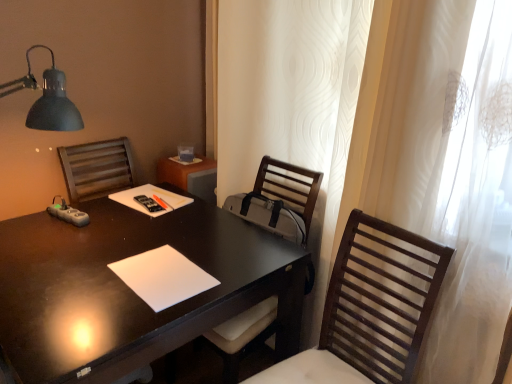
In order to click on free space to the back side of white matte notepad at center in this screenshot , I will do `click(192, 230)`.